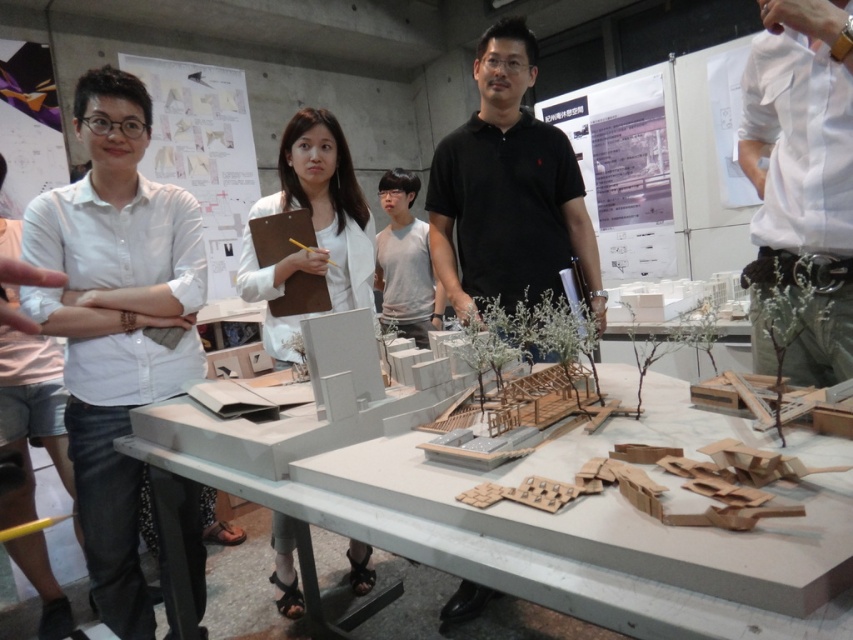
You are an architect examining the scene. You notice the white matte table at center and the white matte model at center. Which object is located below the other?

The white matte table at center is positioned under the white matte model at center, meaning the table is below the model.

Consider the image. You are standing at the center of the room and want to greet the person wearing the white shirt at left. In which direction should you walk to reach them?

The white shirt at left is located at point 0.502 on the x and 0.136 on the y coordinates. Since you are at the center, which is typically at coordinates around 0.5 on both axes, you should walk slightly to the left and forward to reach the person wearing the white shirt at left.